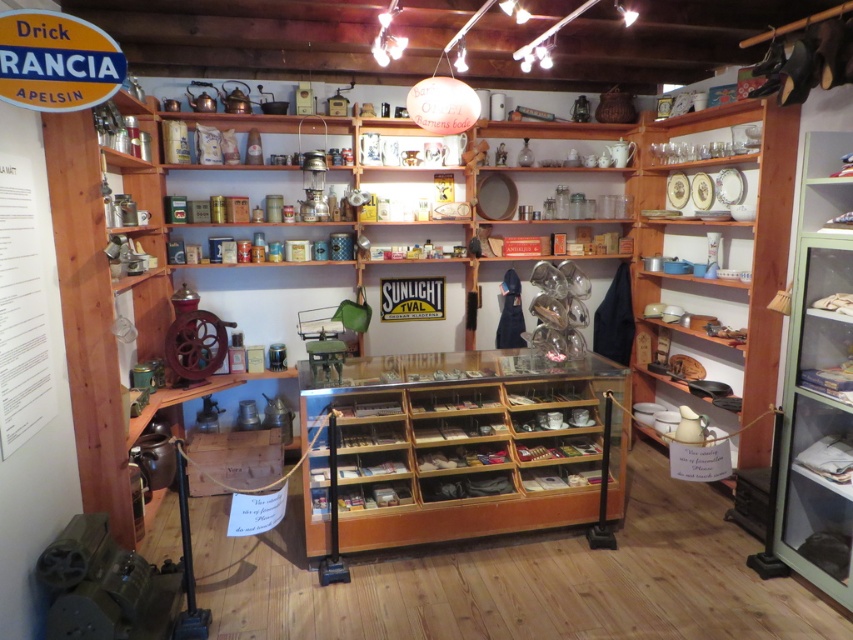
Question: Which point is farther from the camera taking this photo?

Choices:
 (A) (821, 582)
 (B) (448, 449)

Answer: (B)

Question: Can you confirm if wooden display case at center is bigger than green glass cabinet at right?

Choices:
 (A) no
 (B) yes

Answer: (B)

Question: Does wooden display case at center have a greater width compared to green glass cabinet at right?

Choices:
 (A) no
 (B) yes

Answer: (B)

Question: Does wooden display case at center have a larger size compared to green glass cabinet at right?

Choices:
 (A) yes
 (B) no

Answer: (A)